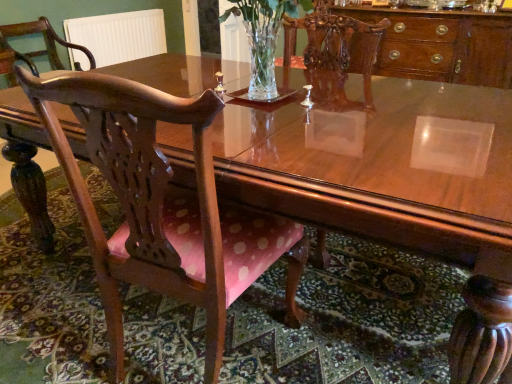
This screenshot has width=512, height=384. Find the location of `vacant space to the right of clear glass vase at center`. vacant space to the right of clear glass vase at center is located at coordinates (372, 108).